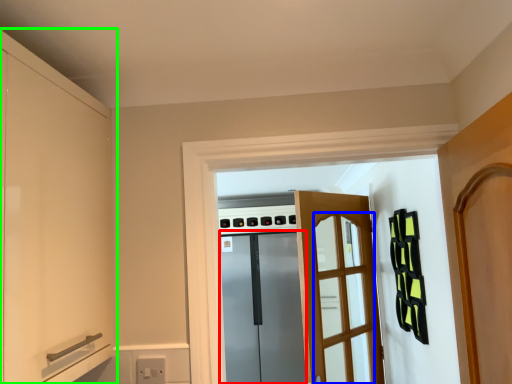
Question: Considering the real-world distances, which object is farthest from screen door (highlighted by a red box)? screen door (highlighted by a blue box) or cabinetry (highlighted by a green box)?

Choices:
 (A) screen door
 (B) cabinetry

Answer: (B)